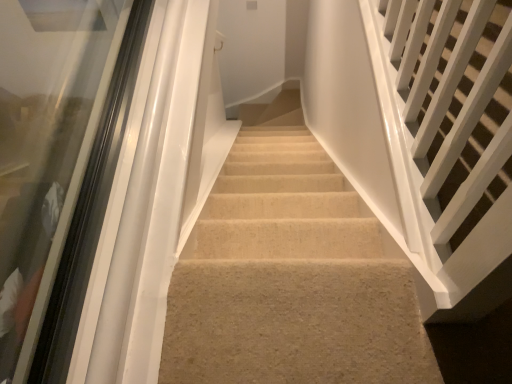
Question: Considering the relative sizes of white glossy rail at right, which is the 1th stairs from right to left, and beige carpet at center, which is counted as the first stairs, starting from the left, in the image provided, is white glossy rail at right, which is the 1th stairs from right to left, smaller than beige carpet at center, which is counted as the first stairs, starting from the left,?

Choices:
 (A) yes
 (B) no

Answer: (B)

Question: Is white glossy rail at right, which is the 1th stairs from right to left, taller than beige carpet at center, which is counted as the first stairs, starting from the left?

Choices:
 (A) yes
 (B) no

Answer: (A)

Question: Considering the relative positions of white glossy rail at right, the second stairs in the left-to-right sequence, and beige carpet at center, which is counted as the first stairs, starting from the left, in the image provided, is white glossy rail at right, the second stairs in the left-to-right sequence, to the left of beige carpet at center, which is counted as the first stairs, starting from the left, from the viewer's perspective?

Choices:
 (A) no
 (B) yes

Answer: (A)

Question: Considering the relative sizes of white glossy rail at right, the second stairs in the left-to-right sequence, and beige carpet at center, which is counted as the first stairs, starting from the left, in the image provided, is white glossy rail at right, the second stairs in the left-to-right sequence, shorter than beige carpet at center, which is counted as the first stairs, starting from the left,?

Choices:
 (A) no
 (B) yes

Answer: (A)

Question: From a real-world perspective, does white glossy rail at right, the second stairs in the left-to-right sequence, stand above beige carpet at center, the second stairs from the right?

Choices:
 (A) no
 (B) yes

Answer: (B)

Question: In terms of size, does transparent glass door at left appear bigger or smaller than beige carpet at center, the second stairs from the right?

Choices:
 (A) small
 (B) big

Answer: (B)

Question: Based on their positions, is transparent glass door at left located to the left or right of beige carpet at center, which is counted as the first stairs, starting from the left?

Choices:
 (A) right
 (B) left

Answer: (B)

Question: From a real-world perspective, is transparent glass door at left physically located above or below beige carpet at center, which is counted as the first stairs, starting from the left?

Choices:
 (A) below
 (B) above

Answer: (B)

Question: From the image's perspective, is transparent glass door at left above or below beige carpet at center, the second stairs from the right?

Choices:
 (A) below
 (B) above

Answer: (B)

Question: From a real-world perspective, relative to white glossy rail at right, the second stairs in the left-to-right sequence, is transparent glass door at left vertically above or below?

Choices:
 (A) below
 (B) above

Answer: (A)

Question: Is transparent glass door at left taller or shorter than white glossy rail at right, the second stairs in the left-to-right sequence?

Choices:
 (A) tall
 (B) short

Answer: (B)

Question: In the image, is transparent glass door at left positioned in front of or behind white glossy rail at right, the second stairs in the left-to-right sequence?

Choices:
 (A) behind
 (B) front

Answer: (A)

Question: From the image's perspective, relative to white glossy rail at right, which is the 1th stairs from right to left, is transparent glass door at left above or below?

Choices:
 (A) above
 (B) below

Answer: (B)

Question: From a real-world perspective, is white glossy rail at right, the second stairs in the left-to-right sequence, positioned above or below transparent glass door at left?

Choices:
 (A) below
 (B) above

Answer: (B)

Question: From their relative heights in the image, would you say white glossy rail at right, which is the 1th stairs from right to left, is taller or shorter than transparent glass door at left?

Choices:
 (A) tall
 (B) short

Answer: (A)